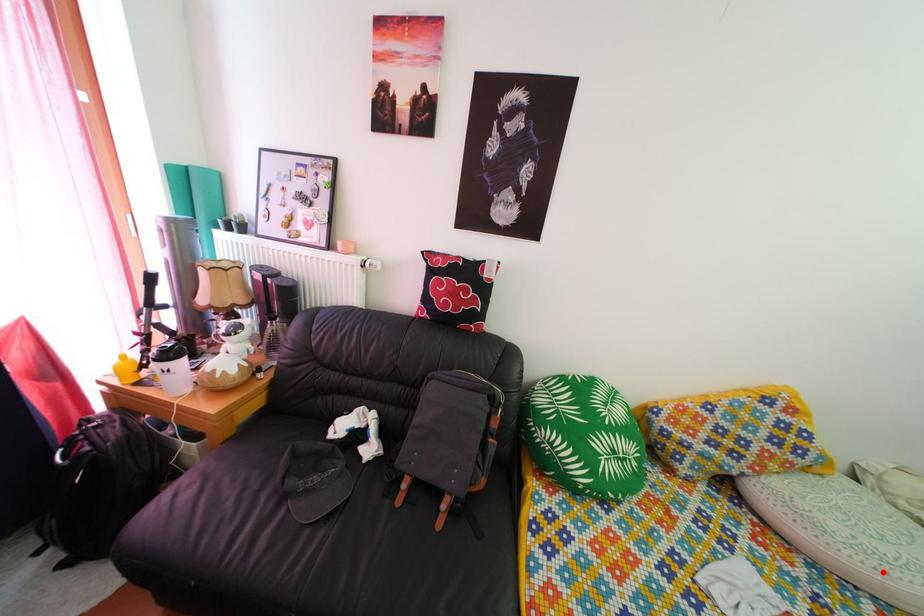
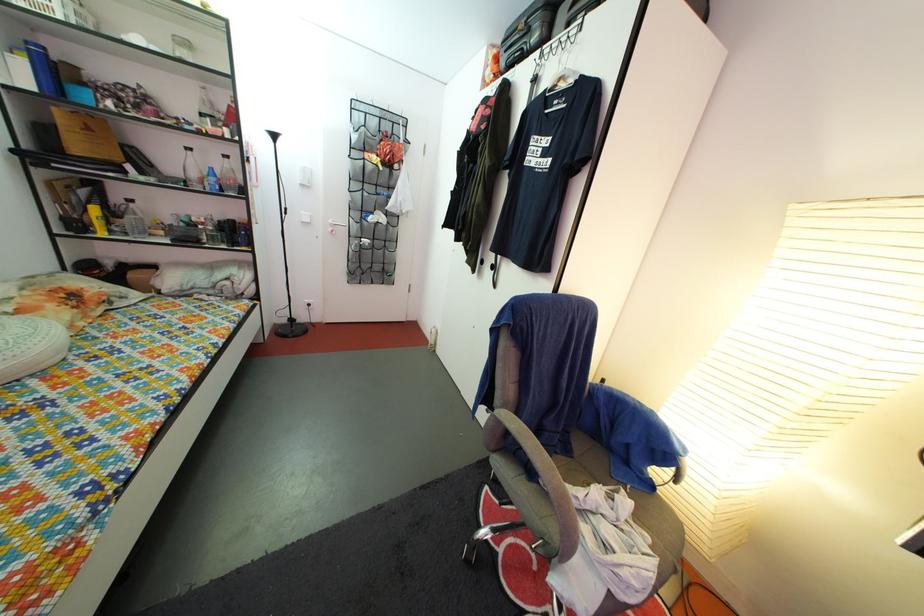
Where in the second image is the point corresponding to the highlighted location from the first image?

(9, 366)